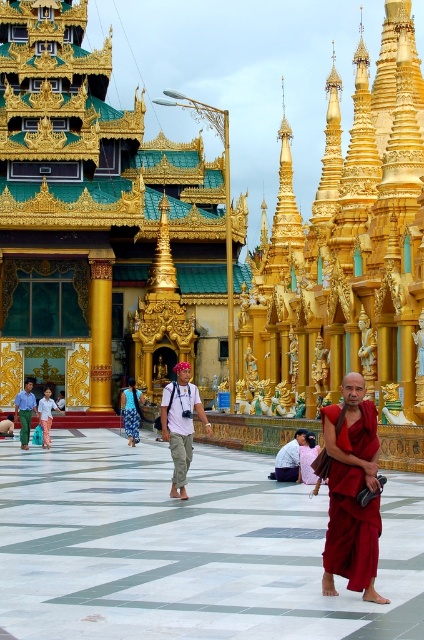
Question: Which of the following is the farthest from the observer?

Choices:
 (A) (142, 401)
 (B) (206, 422)
 (C) (295, 442)

Answer: (A)

Question: Which of the following is the farthest from the observer?

Choices:
 (A) (334, 563)
 (B) (47, 419)
 (C) (25, 406)
 (D) (296, 445)

Answer: (C)

Question: Is red cotton robe at center to the left of blue printed fabric robe at center from the viewer's perspective?

Choices:
 (A) no
 (B) yes

Answer: (A)

Question: Is khaki pants at center further to the viewer compared to light brown leather jacket at center?

Choices:
 (A) no
 (B) yes

Answer: (A)

Question: Among these objects, which one is nearest to the camera?

Choices:
 (A) light brown leather jacket at center
 (B) light pink cotton pants at center
 (C) light blue cotton shirt at center
 (D) khaki pants at center

Answer: (D)

Question: Can you confirm if light brown leather jacket at center is smaller than light pink cotton pants at center?

Choices:
 (A) no
 (B) yes

Answer: (B)